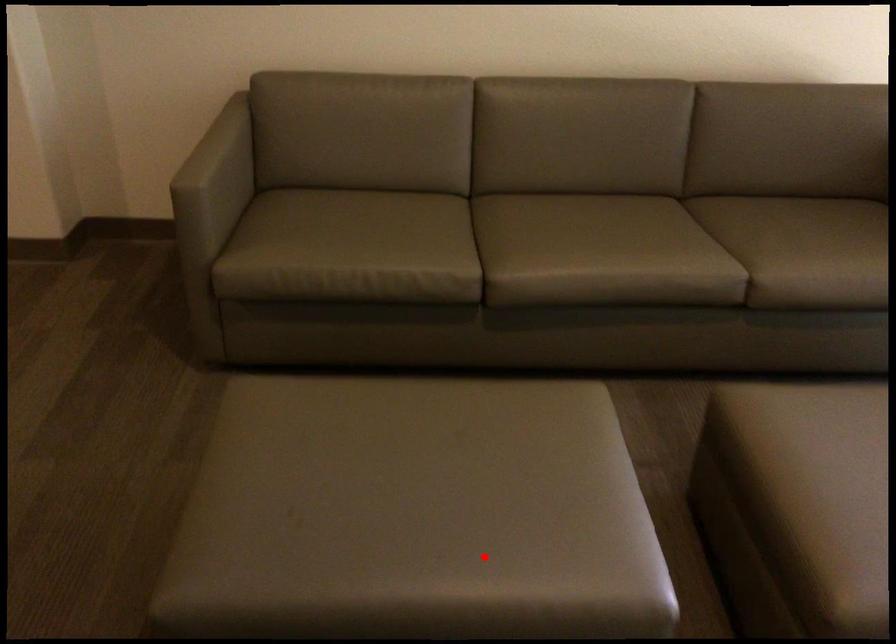
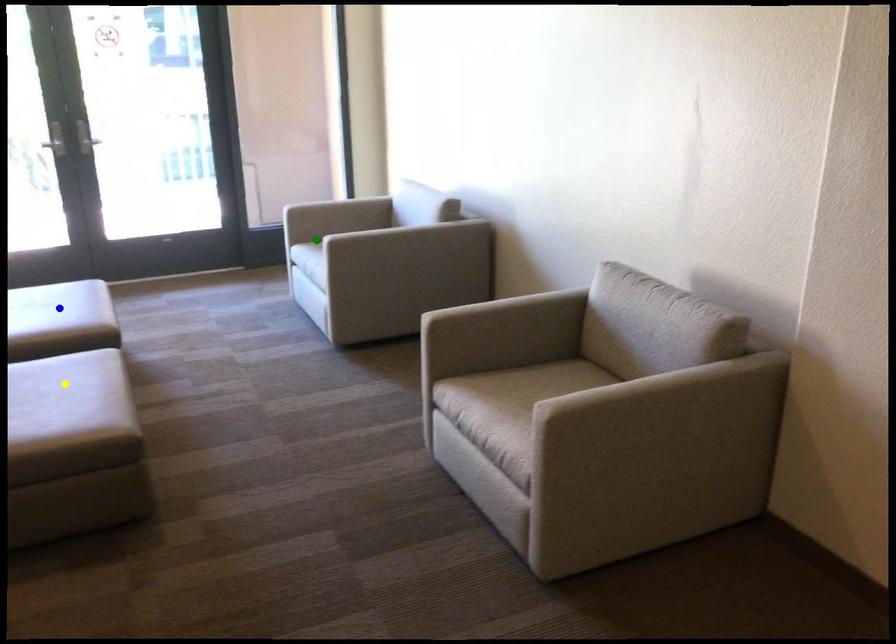
Question: I am providing you with two images of the same scene from different viewpoints. A red point is marked on the first image. You are given multiple points on the second image. In image 2, which mark is for the same physical point as the one in image 1?

Choices:
 (A) yellow point
 (B) green point
 (C) blue point

Answer: (A)